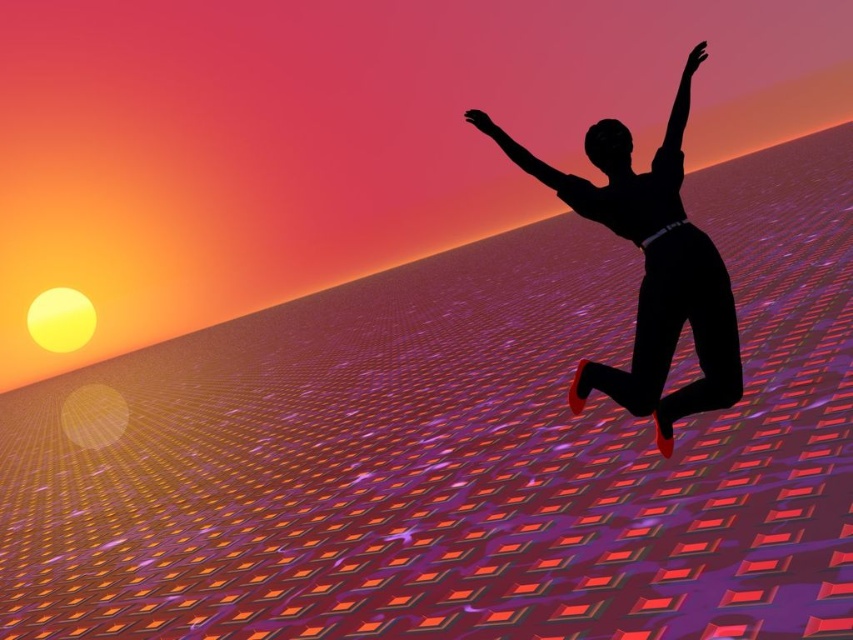
Does black matte figure at upper right have a larger size compared to black matte arm at upper center?

Yes, black matte figure at upper right is bigger than black matte arm at upper center.

Between black matte figure at upper right and black matte arm at upper center, which one has more height?

black matte figure at upper right

Identify the location of black matte figure at upper right. (650, 268).

The width and height of the screenshot is (853, 640). Find the location of `black matte figure at upper right`. black matte figure at upper right is located at coordinates (650, 268).

Describe the element at coordinates (650, 268) in the screenshot. This screenshot has height=640, width=853. I see `black matte figure at upper right` at that location.

Identify the location of black matte figure at upper right. This screenshot has width=853, height=640. (x=650, y=268).

Is black matte arm at upper center smaller than black matte arm at upper right?

Yes, black matte arm at upper center is smaller than black matte arm at upper right.

Can you confirm if black matte arm at upper center is taller than black matte arm at upper right?

No, black matte arm at upper center is not taller than black matte arm at upper right.

Does point (573, 184) lie in front of point (676, 120)?

Yes, point (573, 184) is closer to viewer.

Where is `black matte arm at upper center`? This screenshot has height=640, width=853. black matte arm at upper center is located at coordinates (531, 160).